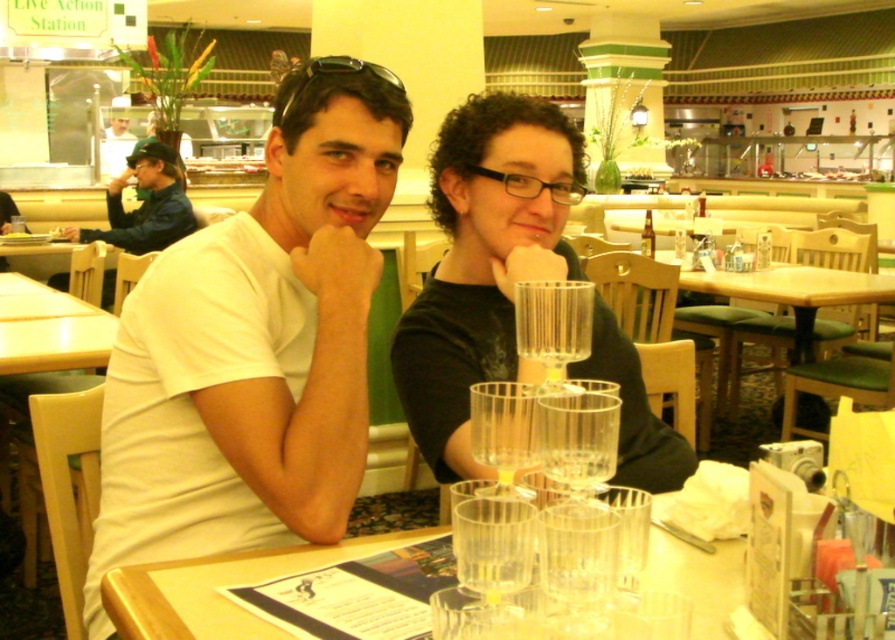
Question: Which object is positioned farthest from the clear glass cups at center?

Choices:
 (A) sunglasses at center
 (B) white matte t-shirt at center
 (C) light brown wood table at left
 (D) clear glass at center

Answer: (C)

Question: Does clear glass cups at center appear under clear glass at center?

Choices:
 (A) yes
 (B) no

Answer: (A)

Question: Which object appears closest to the camera in this image?

Choices:
 (A) matte white shirt at center
 (B) clear glass cups at center
 (C) wooden table at center
 (D) light brown wood table at left

Answer: (B)

Question: Is light brown wood table at left smaller than clear glass at center?

Choices:
 (A) yes
 (B) no

Answer: (B)

Question: From the image, what is the correct spatial relationship of white matte t-shirt at center in relation to light brown wood table at left?

Choices:
 (A) below
 (B) above

Answer: (A)

Question: Which of these objects is positioned closest to the wooden table at center?

Choices:
 (A) clear glass at center
 (B) matte white shirt at center
 (C) sunglasses at center

Answer: (B)